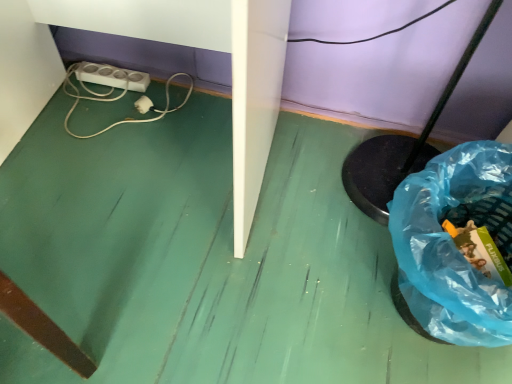
Locate an element on the screen. vacant space situated on the left part of blue plastic bag at lower right is located at coordinates (298, 283).